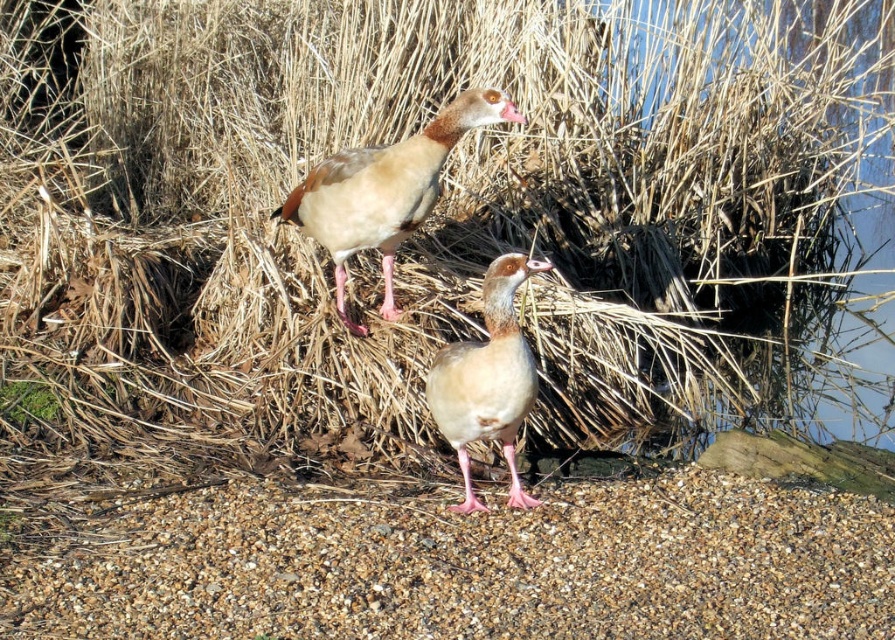
Question: Which of the following is the farthest from the observer?

Choices:
 (A) brown feathered duck at upper center
 (B) brown gravel at lower center
 (C) brown feathered duck at center

Answer: (A)

Question: Which point is closer to the camera?

Choices:
 (A) (533, 266)
 (B) (418, 156)
 (C) (705, 547)

Answer: (A)

Question: Does brown gravel at lower center appear on the right side of brown feathered duck at upper center?

Choices:
 (A) no
 (B) yes

Answer: (B)

Question: Does brown gravel at lower center have a smaller size compared to brown feathered duck at center?

Choices:
 (A) yes
 (B) no

Answer: (B)

Question: Based on their relative distances, which object is nearer to the brown feathered duck at center?

Choices:
 (A) brown gravel at lower center
 (B) brown feathered duck at upper center

Answer: (A)

Question: Does brown feathered duck at upper center lie behind brown feathered duck at center?

Choices:
 (A) yes
 (B) no

Answer: (A)